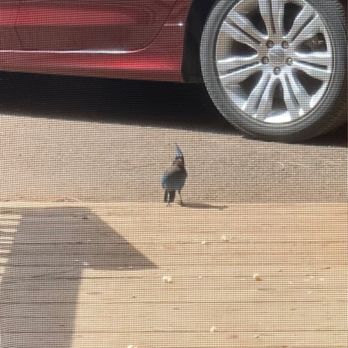
Where is `food debris`? This screenshot has width=348, height=348. food debris is located at coordinates (167, 280).